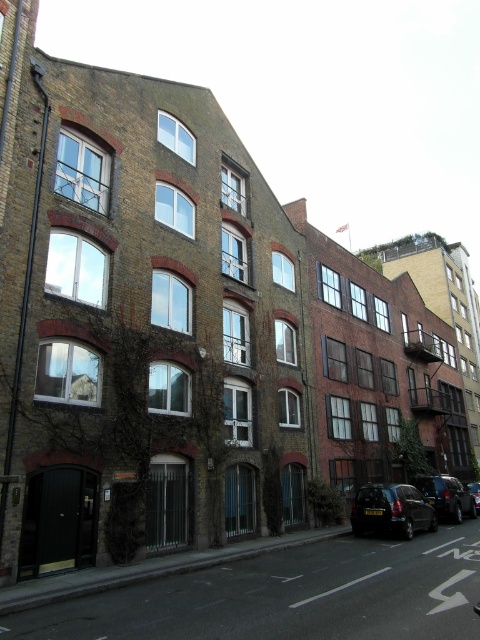
Question: Is green ivy at center thinner than shiny black car at center?

Choices:
 (A) no
 (B) yes

Answer: (B)

Question: Which point is farther to the camera?

Choices:
 (A) (466, 484)
 (B) (402, 492)

Answer: (A)

Question: Which of these objects is positioned closest to the black matte car at lower right?

Choices:
 (A) shiny black car at lower right
 (B) green ivy at center

Answer: (A)

Question: Can you confirm if shiny black car at lower right is positioned to the left of shiny black car at center?

Choices:
 (A) yes
 (B) no

Answer: (A)

Question: Considering the real-world distances, which object is farthest from the shiny black car at center?

Choices:
 (A) shiny black car at lower right
 (B) black matte car at lower right
 (C) green ivy at center

Answer: (C)

Question: Is shiny black car at lower right below shiny black car at center?

Choices:
 (A) no
 (B) yes

Answer: (A)